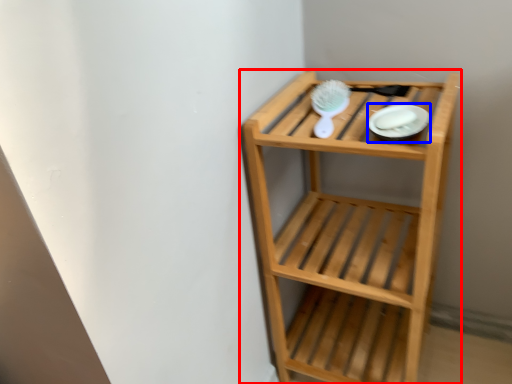
Question: Which object appears farthest to the camera in this image, shelf (highlighted by a red box) or platter (highlighted by a blue box)?

Choices:
 (A) shelf
 (B) platter

Answer: (B)